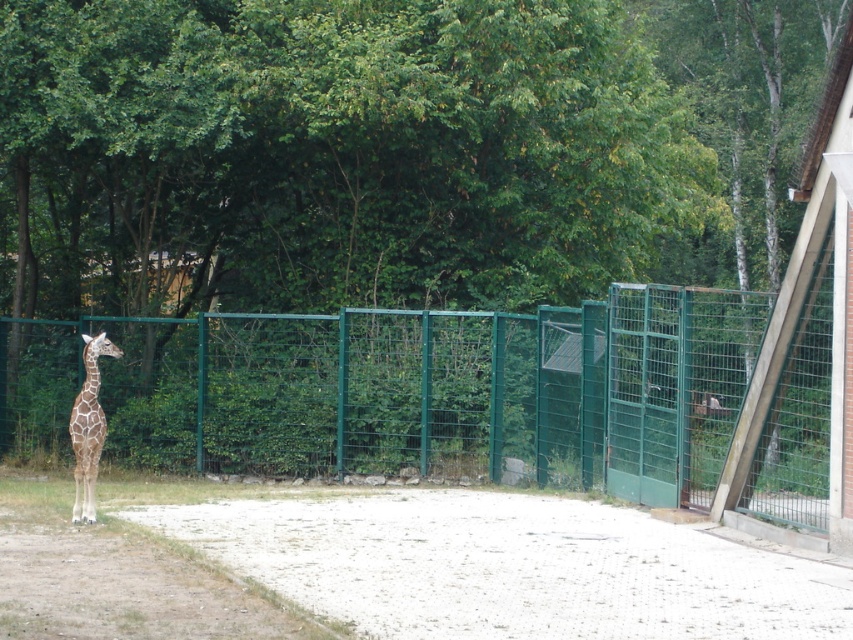
Based on the photo, which is more to the right, green wire mesh fence at left or white gravel at center?

Positioned to the right is green wire mesh fence at left.

Which is in front, point (495, 317) or point (293, 586)?

Point (293, 586) is more forward.

You are a GUI agent. You are given a task and a screenshot of the screen. Output one action in this format:
    pyautogui.click(x=<x>, y=<y>)
    Task: Click on the green wire mesh fence at left
    
    Given the screenshot: What is the action you would take?
    pyautogui.click(x=410, y=392)

What do you see at coordinates (410, 392) in the screenshot? I see `green wire mesh fence at left` at bounding box center [410, 392].

Which is above, green wire mesh fence at left or spotted fur giraffe at left?

green wire mesh fence at left is higher up.

You are a GUI agent. You are given a task and a screenshot of the screen. Output one action in this format:
    pyautogui.click(x=<x>, y=<y>)
    Task: Click on the green wire mesh fence at left
    
    Given the screenshot: What is the action you would take?
    pyautogui.click(x=410, y=392)

Does white gravel at center come behind spotted fur giraffe at left?

No, it is not.

Where is `white gravel at center`? Image resolution: width=853 pixels, height=640 pixels. white gravel at center is located at coordinates (389, 566).

Measure the distance between point (x=392, y=570) and camera.

A distance of 11.18 meters exists between point (x=392, y=570) and camera.

Image resolution: width=853 pixels, height=640 pixels. In order to click on white gravel at center in this screenshot , I will do `click(389, 566)`.